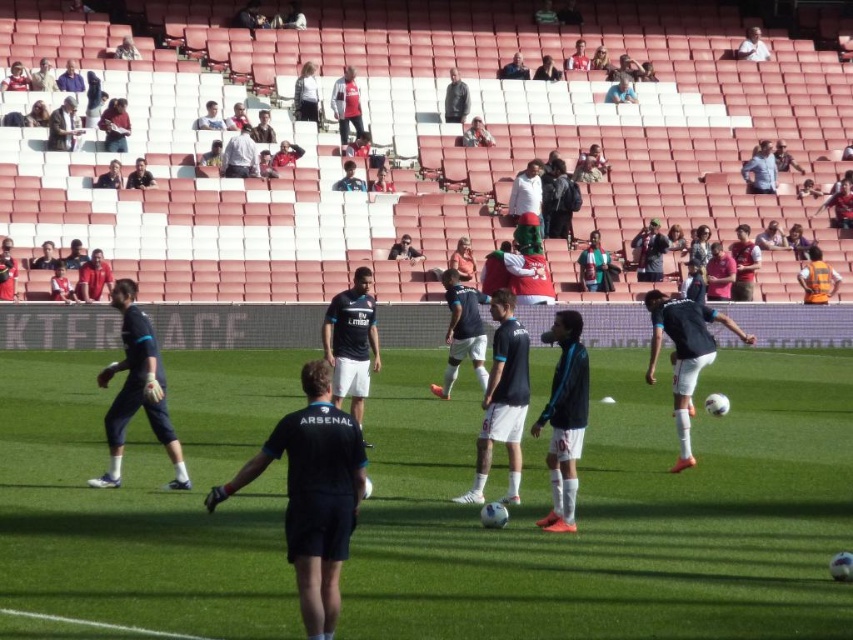
Question: Which object is closer to the camera taking this photo?

Choices:
 (A) black matte jersey at center
 (B) green grass football field at center

Answer: (B)

Question: Is green grass football field at center above black matte jersey at center?

Choices:
 (A) yes
 (B) no

Answer: (B)

Question: Is green grass football field at center closer to the viewer compared to black matte jersey at center?

Choices:
 (A) no
 (B) yes

Answer: (B)

Question: Which object appears closest to the camera in this image?

Choices:
 (A) black matte jersey at center
 (B) green grass football field at center

Answer: (B)

Question: Does green grass football field at center appear on the left side of black matte jersey at center?

Choices:
 (A) yes
 (B) no

Answer: (A)